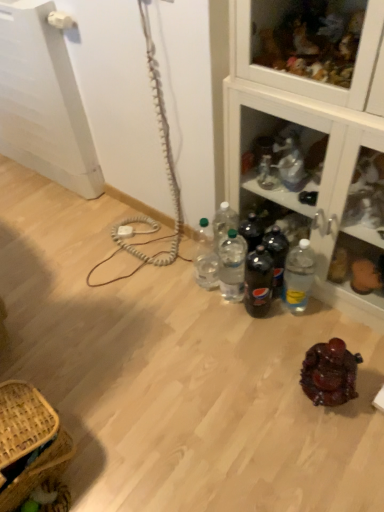
You are a GUI agent. You are given a task and a screenshot of the screen. Output one action in this format:
    pyautogui.click(x=<x>, y=<y>)
    Task: Click on the blank space to the left of clear plastic bottles at center, the first bottle in the left-to-right sequence
    This screenshot has width=384, height=512.
    Given the screenshot: What is the action you would take?
    pyautogui.click(x=169, y=284)